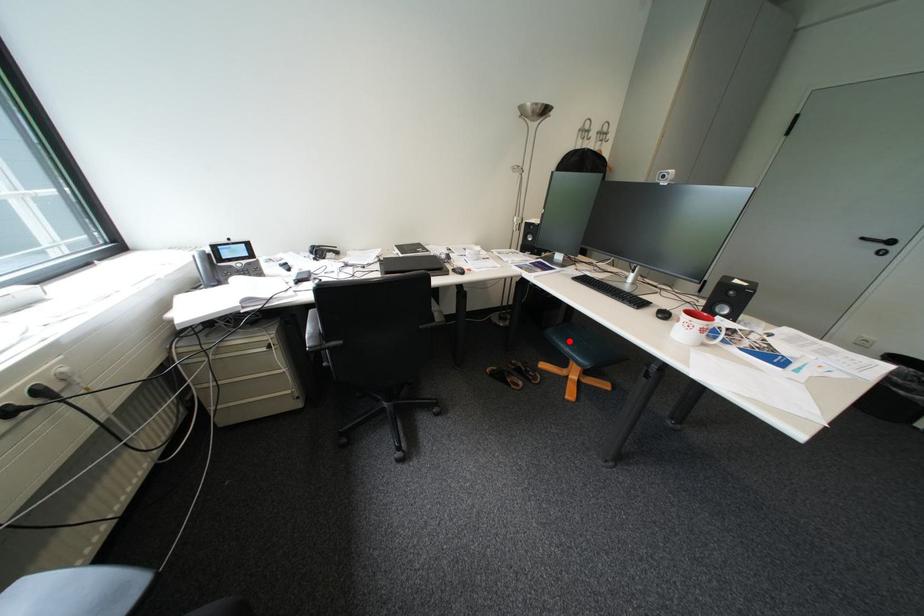
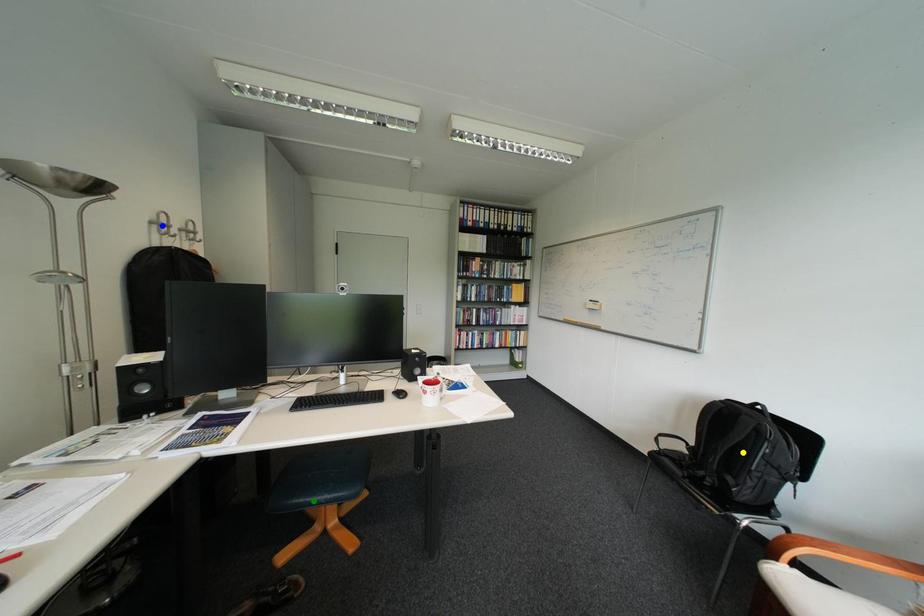
Question: I am providing you with two images of the same scene from different viewpoints. A red point is marked on the first image. You are given multiple points on the second image. Which mark in image 2 goes with the point in image 1?

Choices:
 (A) yellow point
 (B) green point
 (C) blue point

Answer: (B)